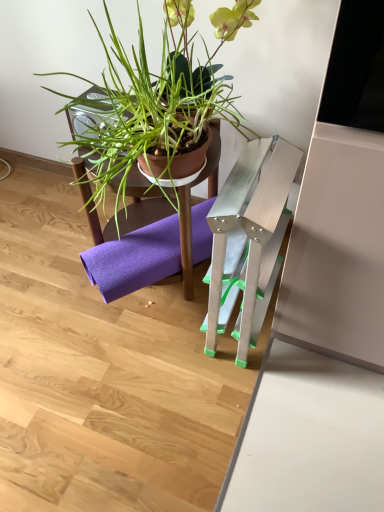
Image resolution: width=384 pixels, height=512 pixels. What do you see at coordinates (135, 259) in the screenshot? I see `purple fabric yoga mat at lower center` at bounding box center [135, 259].

What do you see at coordinates (158, 99) in the screenshot? I see `matte brown pot at center` at bounding box center [158, 99].

Measure the distance between brown matte plant pot at upper center and camera.

brown matte plant pot at upper center and camera are 3.67 feet apart.

Where is `purple fabric yoga mat at lower center`? The width and height of the screenshot is (384, 512). purple fabric yoga mat at lower center is located at coordinates (135, 259).

Consider the image. Is brown matte plant pot at upper center aimed at matte brown pot at center?

No, brown matte plant pot at upper center does not turn towards matte brown pot at center.

Which is correct: brown matte plant pot at upper center is inside matte brown pot at center, or outside of it?

brown matte plant pot at upper center lies outside matte brown pot at center.

From a real-world perspective, is brown matte plant pot at upper center located beneath matte brown pot at center?

Yes, from a real-world perspective, brown matte plant pot at upper center is below matte brown pot at center.

Does point (127, 223) lie behind point (159, 142)?

Yes, it is.

How different are the orientations of brown matte plant pot at upper center and purple fabric yoga mat at lower center in degrees?

brown matte plant pot at upper center and purple fabric yoga mat at lower center are facing 36.9 degrees away from each other.

Is brown matte plant pot at upper center turned away from purple fabric yoga mat at lower center?

Yes, purple fabric yoga mat at lower center is at the back of brown matte plant pot at upper center.

Between brown matte plant pot at upper center and purple fabric yoga mat at lower center, which one has less height?

With less height is purple fabric yoga mat at lower center.

Considering the sizes of brown matte plant pot at upper center and purple fabric yoga mat at lower center in the image, is brown matte plant pot at upper center wider or thinner than purple fabric yoga mat at lower center?

Considering their sizes, brown matte plant pot at upper center looks slimmer than purple fabric yoga mat at lower center.

Is purple fabric yoga mat at lower center looking in the opposite direction of brown matte plant pot at upper center?

Yes, purple fabric yoga mat at lower center's orientation is away from brown matte plant pot at upper center.

From the picture: From a real-world perspective, is purple fabric yoga mat at lower center below brown matte plant pot at upper center?

Yes.

Considering the sizes of purple fabric yoga mat at lower center and brown matte plant pot at upper center in the image, is purple fabric yoga mat at lower center bigger or smaller than brown matte plant pot at upper center?

purple fabric yoga mat at lower center is smaller than brown matte plant pot at upper center.

Does matte brown pot at center appear on the left side of brown matte plant pot at upper center?

Indeed, matte brown pot at center is positioned on the left side of brown matte plant pot at upper center.

Considering the sizes of objects matte brown pot at center and brown matte plant pot at upper center in the image provided, who is thinner, matte brown pot at center or brown matte plant pot at upper center?

brown matte plant pot at upper center is thinner.

Find the location of a particular element. This screenshot has width=384, height=512. houseplant above the brown matte plant pot at upper center (from the image's perspective) is located at coordinates click(158, 99).

Is matte brown pot at center facing away from brown matte plant pot at upper center?

No, matte brown pot at center's orientation is not away from brown matte plant pot at upper center.

Measure the distance from matte brown pot at center to purple fabric yoga mat at lower center.

matte brown pot at center is 16.40 inches from purple fabric yoga mat at lower center.

Which object is further away from the camera, matte brown pot at center or purple fabric yoga mat at lower center?

Positioned behind is purple fabric yoga mat at lower center.

Is matte brown pot at center turned away from purple fabric yoga mat at lower center?

No, purple fabric yoga mat at lower center is not at the back of matte brown pot at center.

Is matte brown pot at center at the right side of purple fabric yoga mat at lower center?

No, matte brown pot at center is not to the right of purple fabric yoga mat at lower center.

Can you tell me how much purple fabric yoga mat at lower center and matte brown pot at center differ in facing direction?

36.4 degrees separate the facing orientations of purple fabric yoga mat at lower center and matte brown pot at center.

How distant is purple fabric yoga mat at lower center from matte brown pot at center?

16.40 inches.

Can you confirm if purple fabric yoga mat at lower center is thinner than matte brown pot at center?

No, purple fabric yoga mat at lower center is not thinner than matte brown pot at center.

Is matte brown pot at center a part of purple fabric yoga mat at lower center?

That's incorrect, matte brown pot at center is not inside purple fabric yoga mat at lower center.

Identify the location of chair lying behind the matte brown pot at center. (133, 248).

The width and height of the screenshot is (384, 512). I want to click on chair in front of the purple fabric yoga mat at lower center, so click(133, 248).

Considering their positions, is purple fabric yoga mat at lower center positioned closer to matte brown pot at center than brown matte plant pot at upper center?

Among the two, brown matte plant pot at upper center is located nearer to matte brown pot at center.

Considering their positions, is matte brown pot at center positioned further to brown matte plant pot at upper center than purple fabric yoga mat at lower center?

matte brown pot at center lies further to brown matte plant pot at upper center than the other object.

Which object lies further to the anchor point purple fabric yoga mat at lower center, brown matte plant pot at upper center or matte brown pot at center?

Based on the image, matte brown pot at center appears to be further to purple fabric yoga mat at lower center.

Considering their positions, is brown matte plant pot at upper center positioned further to matte brown pot at center than purple fabric yoga mat at lower center?

purple fabric yoga mat at lower center.

When comparing their distances from brown matte plant pot at upper center, does purple fabric yoga mat at lower center or matte brown pot at center seem further?

matte brown pot at center lies further to brown matte plant pot at upper center than the other object.

Which object lies nearer to the anchor point purple fabric yoga mat at lower center, matte brown pot at center or brown matte plant pot at upper center?

brown matte plant pot at upper center is positioned closer to the anchor purple fabric yoga mat at lower center.

You are a GUI agent. You are given a task and a screenshot of the screen. Output one action in this format:
    pyautogui.click(x=<x>, y=<y>)
    Task: Click on the chair between matte brown pot at center and purple fabric yoga mat at lower center in the front-back direction
    This screenshot has height=512, width=384.
    Given the screenshot: What is the action you would take?
    pyautogui.click(x=133, y=248)